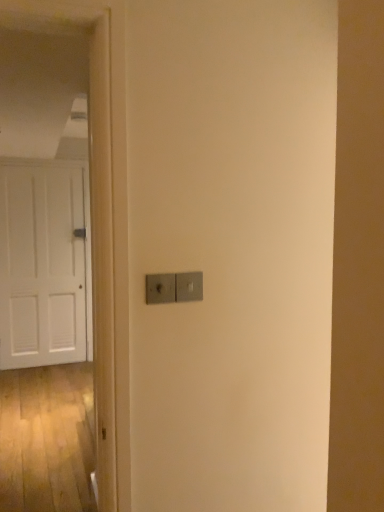
Question: Which direction should I rotate to look at satin silver switch at center, which is counted as the 2th light switch, starting from the left?

Choices:
 (A) left
 (B) right

Answer: (A)

Question: Does satin silver switch at center, which is counted as the 2th light switch, starting from the left, have a greater height compared to white matte door at left?

Choices:
 (A) yes
 (B) no

Answer: (B)

Question: Considering the relative sizes of satin silver switch at center, which is counted as the 2th light switch, starting from the left, and white matte door at left in the image provided, is satin silver switch at center, which is counted as the 2th light switch, starting from the left, smaller than white matte door at left?

Choices:
 (A) no
 (B) yes

Answer: (B)

Question: Would you say satin silver switch at center, which appears as the first light switch when viewed from the right, contains white matte door at left?

Choices:
 (A) yes
 (B) no

Answer: (B)

Question: Is satin silver switch at center, which appears as the first light switch when viewed from the right, further to camera compared to white matte door at left?

Choices:
 (A) yes
 (B) no

Answer: (B)

Question: Is satin silver switch at center, which appears as the first light switch when viewed from the right, outside of white matte door at left?

Choices:
 (A) no
 (B) yes

Answer: (B)

Question: From a real-world perspective, is satin silver switch at center, which is counted as the 2th light switch, starting from the left, located higher than white matte door at left?

Choices:
 (A) no
 (B) yes

Answer: (B)

Question: From the image's perspective, is white matte door at left on satin silver switch at center, the 2th light switch from the right?

Choices:
 (A) yes
 (B) no

Answer: (B)

Question: Is satin silver switch at center, which ranks as the first light switch in left-to-right order, completely or partially inside white matte door at left?

Choices:
 (A) no
 (B) yes

Answer: (A)

Question: Does white matte door at left turn towards satin silver switch at center, the 2th light switch from the right?

Choices:
 (A) yes
 (B) no

Answer: (A)

Question: Does white matte door at left come in front of satin silver switch at center, which ranks as the first light switch in left-to-right order?

Choices:
 (A) no
 (B) yes

Answer: (A)

Question: From a real-world perspective, is white matte door at left positioned under satin silver switch at center, the 2th light switch from the right, based on gravity?

Choices:
 (A) yes
 (B) no

Answer: (A)

Question: Is white matte door at left positioned behind satin silver switch at center, which ranks as the first light switch in left-to-right order?

Choices:
 (A) no
 (B) yes

Answer: (B)

Question: Does satin silver switch at center, the 2th light switch from the right, have a greater width compared to satin silver switch at center, which appears as the first light switch when viewed from the right?

Choices:
 (A) yes
 (B) no

Answer: (A)